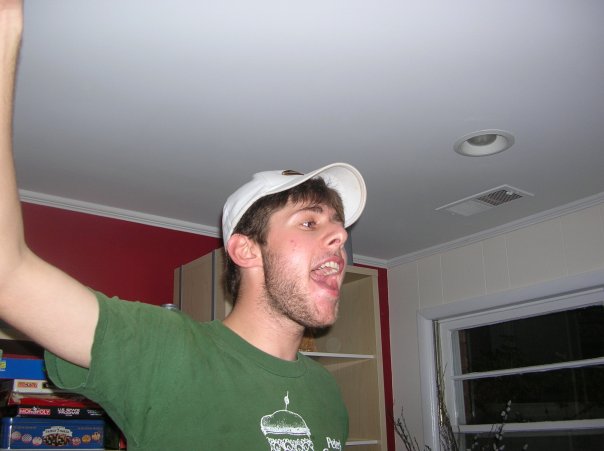
You are a GUI agent. You are given a task and a screenshot of the screen. Output one action in this format:
    pyautogui.click(x=<x>, y=<y>)
    Task: Click on the window frame
    The height and width of the screenshot is (451, 604).
    Given the screenshot: What is the action you would take?
    pyautogui.click(x=464, y=311)